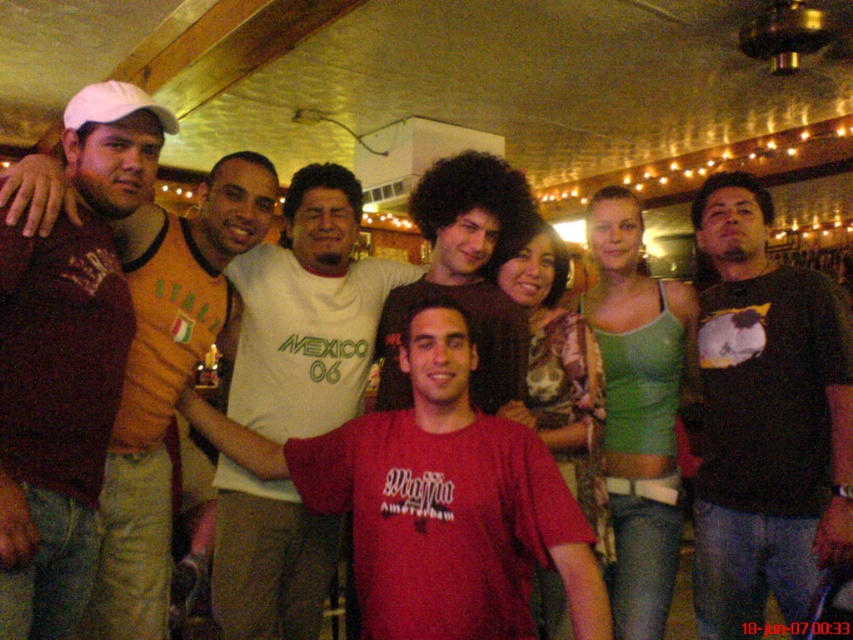
Question: Which point appears farthest from the camera in this image?

Choices:
 (A) (440, 333)
 (B) (361, 387)
 (C) (726, 476)

Answer: (B)

Question: Where is matte red t-shirt at center located in relation to dark brown hair at center in the image?

Choices:
 (A) above
 (B) below

Answer: (B)

Question: Is matte red t-shirt at center bigger than dark brown hair at center?

Choices:
 (A) yes
 (B) no

Answer: (A)

Question: Which of the following is the farthest from the observer?

Choices:
 (A) black t-shirt at center
 (B) dark brown hair at center
 (C) matte maroon shirt at left
 (D) white cotton shirt at center

Answer: (D)

Question: Among these objects, which one is nearest to the camera?

Choices:
 (A) white cotton shirt at center
 (B) matte red t-shirt at center
 (C) matte maroon shirt at left

Answer: (C)

Question: Is white cotton shirt at center positioned behind matte maroon shirt at left?

Choices:
 (A) no
 (B) yes

Answer: (B)